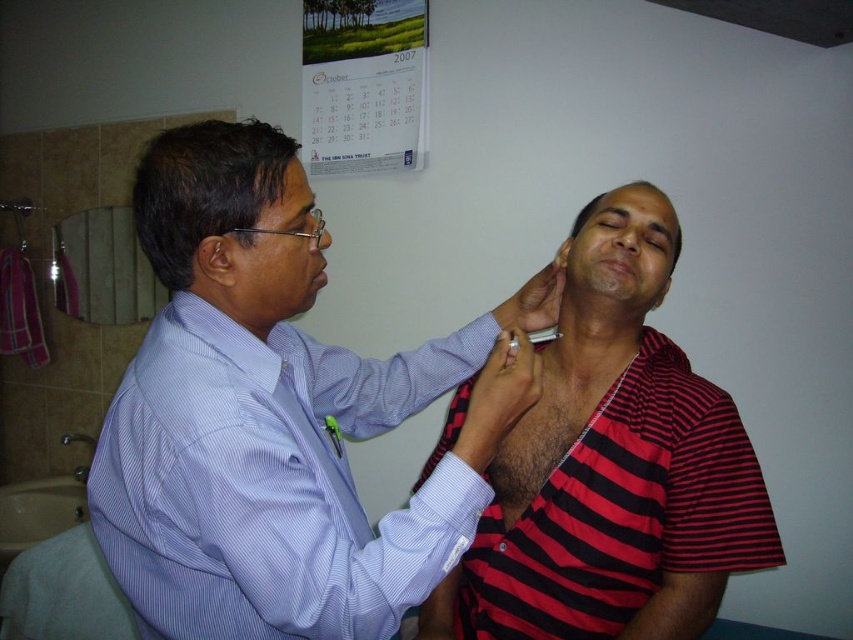
Between blue striped shirt at upper left and red striped shirt at center, which one has more height?

red striped shirt at center is taller.

Based on the photo, can you confirm if blue striped shirt at upper left is wider than red striped shirt at center?

Yes.

What do you see at coordinates (277, 413) in the screenshot?
I see `blue striped shirt at upper left` at bounding box center [277, 413].

This screenshot has height=640, width=853. I want to click on blue striped shirt at upper left, so click(x=277, y=413).